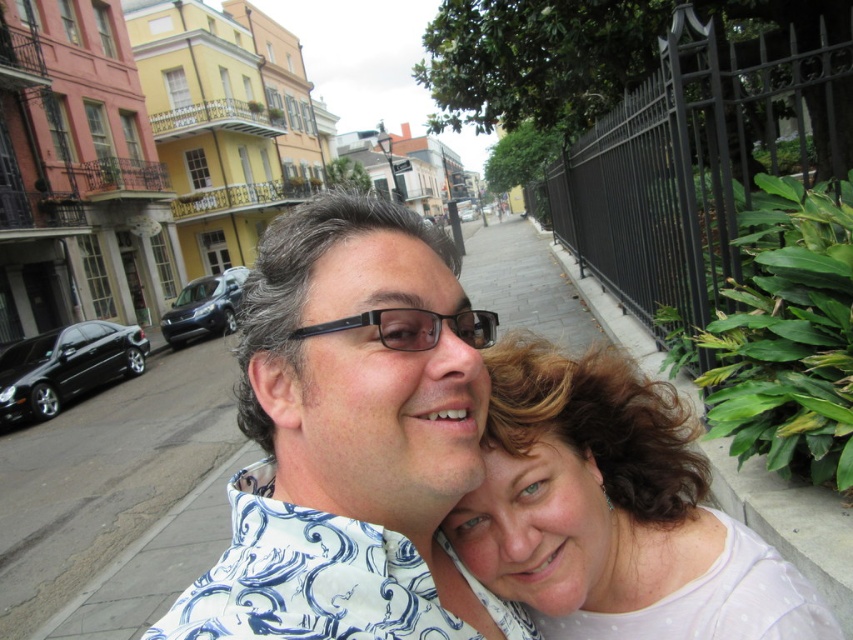
You are standing at the point labeled point (404, 316) and want to move to the point labeled point (401, 547). Given the scene described, can you walk directly forward to reach your destination without needing to turn or adjust your direction?

Yes, you can walk directly forward because point (401, 547) is behind point (404, 316), meaning it is in the same direction as you face forward.

You are a photographer trying to capture both the white dotted shirt at center and the black plastic glasses at center in a single frame. Based on their sizes, which object should you focus on first to ensure both are in clear view?

The white dotted shirt at center is bigger than the black plastic glasses at center, so you should focus on the white dotted shirt at center first to ensure both are in clear view.